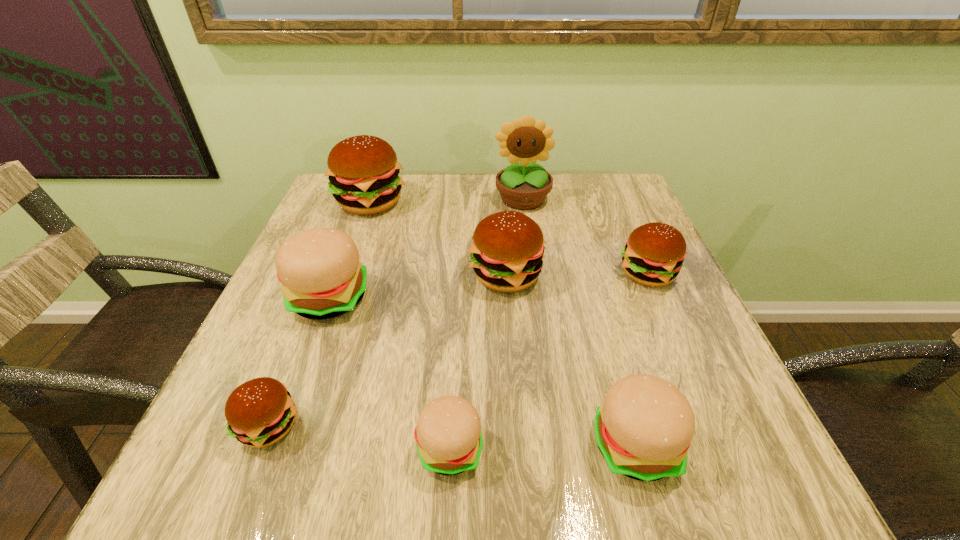
Find the location of `the rightmost beige hamburger`. the rightmost beige hamburger is located at coordinates (643, 429).

Where is `the nearest brown hamburger`? the nearest brown hamburger is located at coordinates (260, 412).

This screenshot has height=540, width=960. I want to click on the second beige hamburger from left to right, so tap(448, 434).

Locate an element on the screen. The height and width of the screenshot is (540, 960). vacant space positioned on the face of the yellow sunflower is located at coordinates (539, 318).

Find the location of a particular element. This screenshot has width=960, height=540. blank space located 0.200m on the front of the second tallest object is located at coordinates (344, 274).

You are a GUI agent. You are given a task and a screenshot of the screen. Output one action in this format:
    pyautogui.click(x=<x>, y=<y>)
    Task: Click on the free spot located 0.350m on the front of the second biggest brown hamburger
    The height and width of the screenshot is (540, 960).
    Given the screenshot: What is the action you would take?
    [520, 470]

Locate an element on the screen. This screenshot has width=960, height=540. vacant point located on the front of the leftmost beige hamburger is located at coordinates (309, 350).

At what (x,y) coordinates should I click in order to perform the action: click on vacant space situated 0.260m on the front of the rightmost hamburger. Please return your answer as a coordinate pair (x, y). The width and height of the screenshot is (960, 540). Looking at the image, I should click on (704, 403).

At what (x,y) coordinates should I click in order to perform the action: click on vacant space located 0.070m on the left of the rightmost beige hamburger. Please return your answer as a coordinate pair (x, y). The image size is (960, 540). Looking at the image, I should click on (546, 444).

Image resolution: width=960 pixels, height=540 pixels. In order to click on vacant position located on the right of the smallest brown hamburger in this screenshot , I will do `click(390, 426)`.